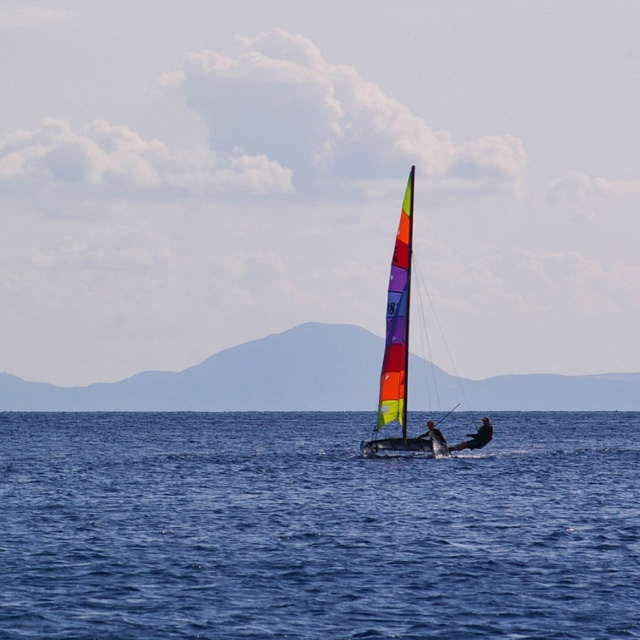
You are a sailor navigating a boat and need to determine the direction of the horizon. Given the coordinates of the blue matte horizon at center as point (234, 378), can you confirm if this point lies directly ahead of your boat?

The blue matte horizon at center is represented by point (234, 378), which would indicate that it is directly ahead of the boat since it is centered in the image.

You are a drone operator trying to capture the sailboat in the image. Your drone has a camera with a limited field of view. You need to focus on both point (396, 300) and point (452, 445). Which point should you position the drone closer to in order to ensure both points are in frame?

To ensure both points are in frame, the drone should be positioned closer to point (396, 300) since it is closer to the viewer than point (452, 445), allowing the camera to capture both points within its limited field of view.